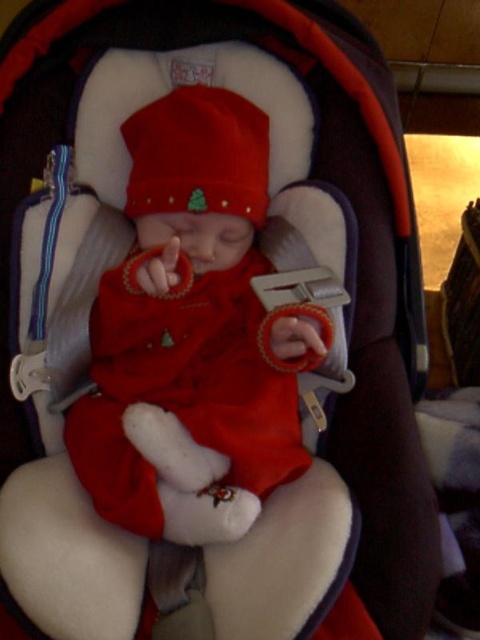
Can you confirm if matte red fabric baby at center is bigger than matte red knit hat at center?

Yes.

Is point (252, 236) positioned after point (168, 180)?

Yes, it is.

The height and width of the screenshot is (640, 480). I want to click on matte red fabric baby at center, so pyautogui.click(x=192, y=333).

The image size is (480, 640). I want to click on matte red fabric baby at center, so 192,333.